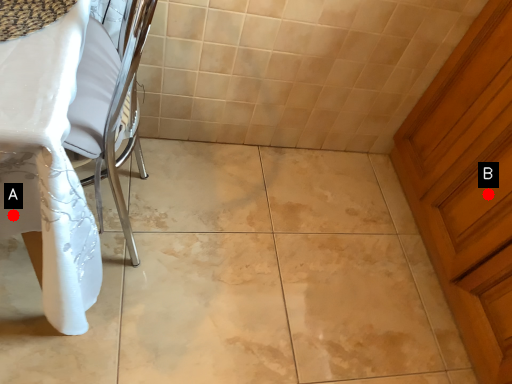
Question: Two points are circled on the image, labeled by A and B beside each circle. Which point is closer to the camera?

Choices:
 (A) A is closer
 (B) B is closer

Answer: (A)